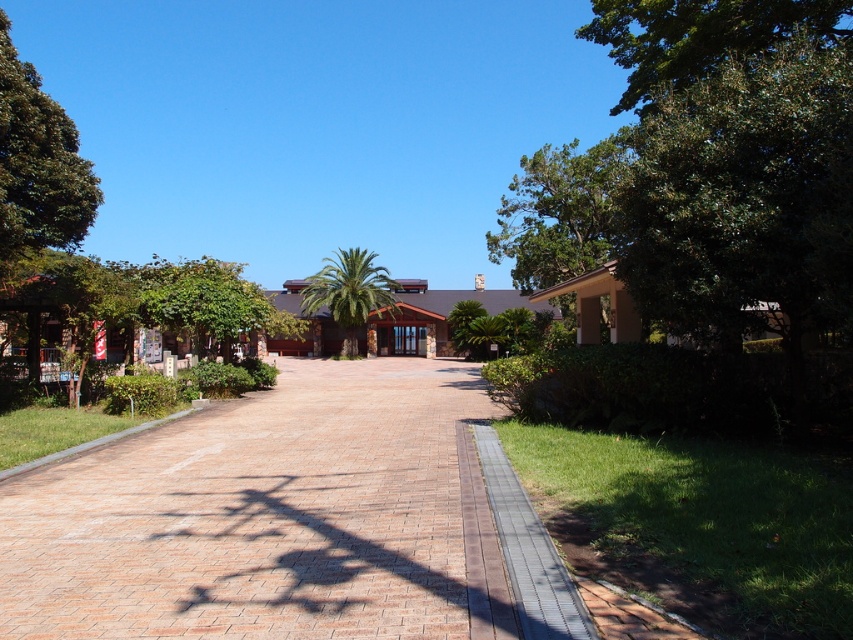
Is point (809, 97) more distant than point (390, 310)?

No, (809, 97) is closer to viewer.

Does green leafy tree at right have a lesser width compared to green leafy palm at center?

Yes.

You are a GUI agent. You are given a task and a screenshot of the screen. Output one action in this format:
    pyautogui.click(x=<x>, y=<y>)
    Task: Click on the green leafy tree at right
    The image size is (853, 640).
    Given the screenshot: What is the action you would take?
    pyautogui.click(x=709, y=172)

Image resolution: width=853 pixels, height=640 pixels. I want to click on green leafy tree at right, so click(x=709, y=172).

Is point (44, 184) less distant than point (471, 314)?

Yes, point (44, 184) is closer to viewer.

Locate an element on the screen. The height and width of the screenshot is (640, 853). green leafy tree at upper left is located at coordinates (38, 163).

Who is more distant from viewer, [589,225] or [462,317]?

The point [462,317] is more distant.

Is green leafy tree at right positioned at the back of green leafy tree at center?

No, it is in front of green leafy tree at center.

Does point (726, 113) come closer to viewer compared to point (469, 336)?

Yes, it is in front of point (469, 336).

The height and width of the screenshot is (640, 853). Find the location of `green leafy tree at right`. green leafy tree at right is located at coordinates (709, 172).